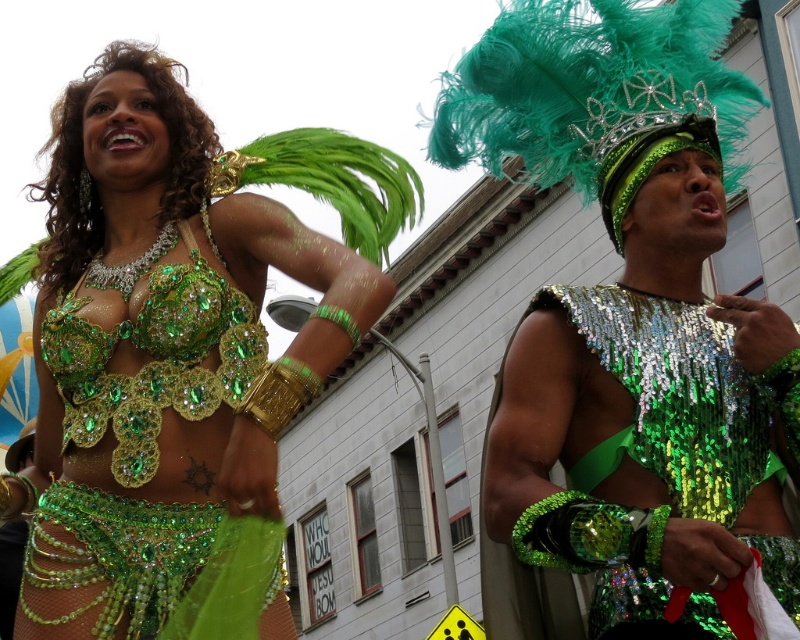
Question: Is shiny sequin vest at center bigger than green sequined bikini top at upper left?

Choices:
 (A) yes
 (B) no

Answer: (A)

Question: Which of the following is the closest to the observer?

Choices:
 (A) (513, 364)
 (B) (525, 596)
 (C) (364, 307)

Answer: (C)

Question: Does shiny sequin vest at center appear over green sequined top at center?

Choices:
 (A) yes
 (B) no

Answer: (A)

Question: Based on their relative distances, which object is nearer to the green sequined top at center?

Choices:
 (A) shiny sequin vest at center
 (B) green sequined bikini top at upper left

Answer: (A)

Question: Among these objects, which one is farthest from the camera?

Choices:
 (A) shiny sequin vest at center
 (B) green sequined top at center

Answer: (B)

Question: Can you confirm if green sequined bikini top at upper left is wider than green sequined top at center?

Choices:
 (A) yes
 (B) no

Answer: (A)